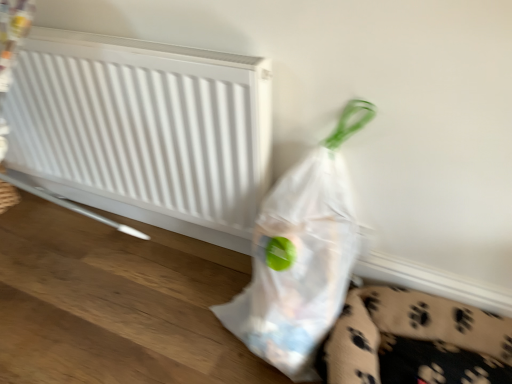
Question: Considering the positions of transparent plastic bag at lower right and white matte radiator at upper left in the image, is transparent plastic bag at lower right wider or thinner than white matte radiator at upper left?

Choices:
 (A) wide
 (B) thin

Answer: (A)

Question: Looking at the image, does transparent plastic bag at lower right seem bigger or smaller compared to white matte radiator at upper left?

Choices:
 (A) small
 (B) big

Answer: (B)

Question: From the image's perspective, is transparent plastic bag at lower right located above or below white matte radiator at upper left?

Choices:
 (A) below
 (B) above

Answer: (A)

Question: From the image's perspective, is white matte radiator at upper left above or below transparent plastic bag at lower right?

Choices:
 (A) below
 (B) above

Answer: (B)

Question: From a real-world perspective, is white matte radiator at upper left positioned above or below transparent plastic bag at lower right?

Choices:
 (A) below
 (B) above

Answer: (B)

Question: Does point (169, 87) appear closer or farther from the camera than point (321, 284)?

Choices:
 (A) closer
 (B) farther

Answer: (B)

Question: Looking at the image, does white matte radiator at upper left seem bigger or smaller compared to transparent plastic bag at lower right?

Choices:
 (A) big
 (B) small

Answer: (B)